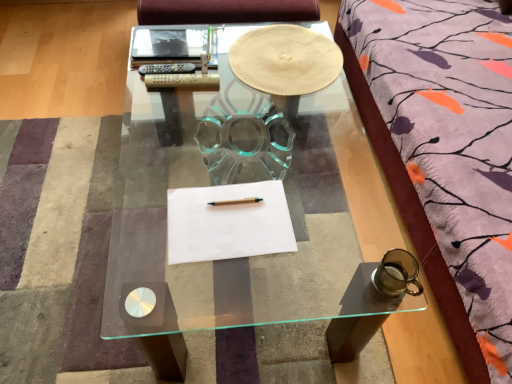
Image resolution: width=512 pixels, height=384 pixels. What are the coordinates of `matte cardboard plate at center` in the screenshot? It's located at (285, 60).

This screenshot has height=384, width=512. I want to click on wooden pencil at center, so click(x=236, y=201).

The height and width of the screenshot is (384, 512). Identify the location of matte cardboard plate at center. (285, 60).

Which of these two, white paper at upper center, positioned as the first notebook in back-to-front order, or white paper at center, the 2th notebook positioned from the back, is wider?

white paper at center, the 2th notebook positioned from the back, is wider.

In terms of height, does white paper at upper center, positioned as the first notebook in back-to-front order, look taller or shorter compared to white paper at center, which appears as the 1th notebook when viewed from the front?

white paper at upper center, positioned as the first notebook in back-to-front order, is taller than white paper at center, which appears as the 1th notebook when viewed from the front.

At what (x,y) coordinates should I click in order to perform the action: click on notebook that appears in front of the white paper at upper center, acting as the 2th notebook starting from the bottom. Please return your answer as a coordinate pair (x, y). Looking at the image, I should click on (228, 222).

From the image's perspective, is white paper at upper center, acting as the 2th notebook starting from the bottom, above or below white paper at center, which is the first notebook from bottom to top?

white paper at upper center, acting as the 2th notebook starting from the bottom, is situated higher than white paper at center, which is the first notebook from bottom to top, in the image.

In the scene shown: Is matte cardboard plate at center surrounded by white paper at center, the 2th notebook positioned from the back?

That's incorrect, matte cardboard plate at center is not inside white paper at center, the 2th notebook positioned from the back.

Is the position of white paper at center, which appears as the 1th notebook when viewed from the front, less distant than that of matte cardboard plate at center?

Yes, white paper at center, which appears as the 1th notebook when viewed from the front, is closer to the camera.

From the image's perspective, between white paper at center, which appears as the 1th notebook when viewed from the front, and matte cardboard plate at center, which one is located above?

matte cardboard plate at center appears higher in the image.

From the picture: Between white paper at center, the 2th notebook positioned from the back, and matte cardboard plate at center, which one has larger width?

With larger width is matte cardboard plate at center.

Is transparent glass coffee table at center placed right next to white paper at center, which appears as the 1th notebook when viewed from the front?

No, transparent glass coffee table at center is not with white paper at center, which appears as the 1th notebook when viewed from the front.

From the picture: Which of these two, transparent glass coffee table at center or white paper at center, which appears as the 1th notebook when viewed from the front, is bigger?

transparent glass coffee table at center is bigger.

Is transparent glass coffee table at center to the left or to the right of white paper at center, the 2th notebook positioned from the back, in the image?

Based on their positions, transparent glass coffee table at center is located to the left of white paper at center, the 2th notebook positioned from the back.

Considering the relative sizes of transparent glass coffee table at center and white paper at center, which appears as the 2th notebook when viewed from the top, in the image provided, is transparent glass coffee table at center taller than white paper at center, which appears as the 2th notebook when viewed from the top,?

Yes.

From a real-world perspective, is white paper at upper center, acting as the 2th notebook starting from the bottom, physically below wooden pencil at center?

No, from a real-world perspective, white paper at upper center, acting as the 2th notebook starting from the bottom, is not under wooden pencil at center.

Could you measure the distance between white paper at upper center, the 2th notebook when ordered from front to back, and wooden pencil at center?

The distance of white paper at upper center, the 2th notebook when ordered from front to back, from wooden pencil at center is 25.16 inches.

Does white paper at upper center, the 2th notebook when ordered from front to back, appear on the left side of wooden pencil at center?

Indeed, white paper at upper center, the 2th notebook when ordered from front to back, is positioned on the left side of wooden pencil at center.

Image resolution: width=512 pixels, height=384 pixels. I want to click on pencil that is under the white paper at upper center, which is the 1th notebook from top to bottom (from a real-world perspective), so click(236, 201).

Does matte cardboard plate at center touch wooden pencil at center?

matte cardboard plate at center and wooden pencil at center are not in contact.

Considering the positions of objects matte cardboard plate at center and wooden pencil at center in the image provided, who is in front, matte cardboard plate at center or wooden pencil at center?

wooden pencil at center is in front.

Would you say white paper at center, the 2th notebook positioned from the back, is to the left or to the right of wooden pencil at center in the picture?

In the image, white paper at center, the 2th notebook positioned from the back, appears on the left side of wooden pencil at center.

Is there a large distance between white paper at center, which is the first notebook from bottom to top, and wooden pencil at center?

white paper at center, which is the first notebook from bottom to top, is actually quite close to wooden pencil at center.

Which object is wider, white paper at center, the 2th notebook positioned from the back, or wooden pencil at center?

white paper at center, the 2th notebook positioned from the back.

Based on the photo, from a real-world perspective, is transparent glass coffee table at center physically below white paper at upper center, which is the 1th notebook from top to bottom?

Yes, from a real-world perspective, transparent glass coffee table at center is beneath white paper at upper center, which is the 1th notebook from top to bottom.

Is transparent glass coffee table at center smaller than white paper at upper center, which is the 1th notebook from top to bottom?

No, transparent glass coffee table at center is not smaller than white paper at upper center, which is the 1th notebook from top to bottom.

From the image's perspective, which object appears higher, transparent glass coffee table at center or white paper at upper center, the 2th notebook when ordered from front to back?

white paper at upper center, the 2th notebook when ordered from front to back, is shown above in the image.

Which of these two, transparent glass coffee table at center or white paper at upper center, the 2th notebook when ordered from front to back, stands taller?

transparent glass coffee table at center is taller.

I want to click on notebook lying above the white paper at center, which is the first notebook from bottom to top (from the image's perspective), so click(x=172, y=43).

Where is `round table that is behind the white paper at center, which appears as the 1th notebook when viewed from the front`? The width and height of the screenshot is (512, 384). round table that is behind the white paper at center, which appears as the 1th notebook when viewed from the front is located at coordinates (285, 60).

Which object lies further to the anchor point wooden pencil at center, matte cardboard plate at center or white paper at upper center, positioned as the first notebook in back-to-front order?

Based on the image, white paper at upper center, positioned as the first notebook in back-to-front order, appears to be further to wooden pencil at center.

Which object lies further to the anchor point matte cardboard plate at center, transparent glass coffee table at center or wooden pencil at center?

The object further to matte cardboard plate at center is wooden pencil at center.

Looking at the image, which one is located closer to transparent glass coffee table at center, wooden pencil at center or white paper at upper center, positioned as the first notebook in back-to-front order?

white paper at upper center, positioned as the first notebook in back-to-front order.

Estimate the real-world distances between objects in this image. Which object is closer to matte cardboard plate at center, wooden pencil at center or white paper at upper center, the 2th notebook when ordered from front to back?

The object closer to matte cardboard plate at center is white paper at upper center, the 2th notebook when ordered from front to back.

Considering their positions, is transparent glass coffee table at center positioned closer to wooden pencil at center than matte cardboard plate at center?

matte cardboard plate at center lies closer to wooden pencil at center than the other object.

Estimate the real-world distances between objects in this image. Which object is further from transparent glass coffee table at center, white paper at upper center, the 2th notebook when ordered from front to back, or white paper at center, which appears as the 2th notebook when viewed from the top?

white paper at upper center, the 2th notebook when ordered from front to back, lies further to transparent glass coffee table at center than the other object.

Based on their spatial positions, is white paper at center, which appears as the 2th notebook when viewed from the top, or transparent glass coffee table at center further from white paper at upper center, which is the 1th notebook from top to bottom?

Among the two, white paper at center, which appears as the 2th notebook when viewed from the top, is located further to white paper at upper center, which is the 1th notebook from top to bottom.

Considering their positions, is transparent glass coffee table at center positioned further to white paper at upper center, the 2th notebook when ordered from front to back, than matte cardboard plate at center?

The object further to white paper at upper center, the 2th notebook when ordered from front to back, is transparent glass coffee table at center.

Locate an element on the screen. round table between white paper at upper center, positioned as the first notebook in back-to-front order, and wooden pencil at center vertically is located at coordinates click(285, 60).

Locate an element on the screen. This screenshot has width=512, height=384. coffee table between white paper at upper center, positioned as the first notebook in back-to-front order, and white paper at center, which appears as the 1th notebook when viewed from the front, in the vertical direction is located at coordinates (245, 208).

Identify the location of coffee table between matte cardboard plate at center and wooden pencil at center vertically. This screenshot has height=384, width=512. (245, 208).

At what (x,y) coordinates should I click in order to perform the action: click on pencil between white paper at upper center, the 2th notebook when ordered from front to back, and white paper at center, which appears as the 2th notebook when viewed from the top, vertically. Please return your answer as a coordinate pair (x, y). This screenshot has width=512, height=384. Looking at the image, I should click on (236, 201).